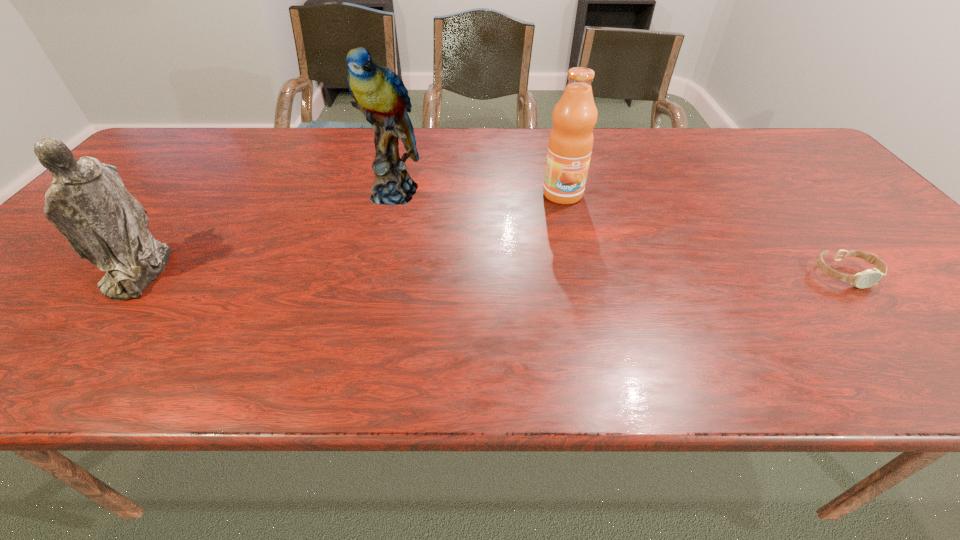
I want to click on vacant space at the right edge of the desktop, so click(796, 180).

Image resolution: width=960 pixels, height=540 pixels. Identify the location of free space that is in between the leftmost object and the tallest object. (265, 231).

In order to click on empty location between the shortest object and the fruit juice in this screenshot , I will do pyautogui.click(x=704, y=234).

Identify the location of free area in between the leftmost object and the rightmost object. This screenshot has width=960, height=540. (492, 273).

The height and width of the screenshot is (540, 960). Find the location of `free space between the second object from left to right and the watch`. free space between the second object from left to right and the watch is located at coordinates (619, 233).

Identify the location of free space between the fruit juice and the rightmost object. (704, 234).

At what (x,y) coordinates should I click in order to perform the action: click on free space between the figurine and the third object from left to right. Please return your answer as a coordinate pair (x, y). Image resolution: width=960 pixels, height=540 pixels. Looking at the image, I should click on (350, 233).

Locate an element on the screen. The height and width of the screenshot is (540, 960). vacant space that is in between the leftmost object and the second object from right to left is located at coordinates (350, 233).

At what (x,y) coordinates should I click in order to perform the action: click on empty space that is in between the shortest object and the third object from left to right. Please return your answer as a coordinate pair (x, y). Looking at the image, I should click on (704, 234).

Where is `free spot between the shortest object and the tallest object`? Image resolution: width=960 pixels, height=540 pixels. free spot between the shortest object and the tallest object is located at coordinates (619, 233).